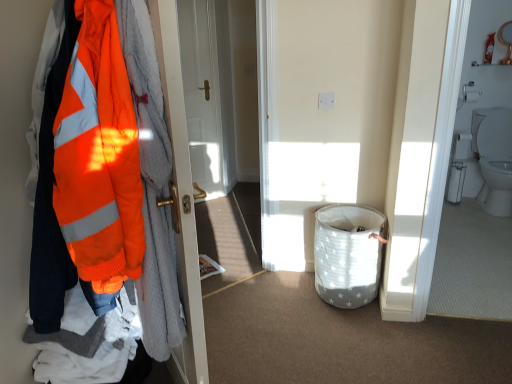
Question: Should I look upward or downward to see white glossy toilet at right?

Choices:
 (A) down
 (B) up

Answer: (B)

Question: From a real-world perspective, is white glossy door at center beneath white glossy toilet at right?

Choices:
 (A) yes
 (B) no

Answer: (B)

Question: Considering the relative positions of white glossy door at center and white glossy toilet at right in the image provided, is white glossy door at center to the right of white glossy toilet at right from the viewer's perspective?

Choices:
 (A) no
 (B) yes

Answer: (A)

Question: Are white glossy door at center and white glossy toilet at right making contact?

Choices:
 (A) yes
 (B) no

Answer: (B)

Question: Does white glossy door at center have a lesser height compared to white glossy toilet at right?

Choices:
 (A) yes
 (B) no

Answer: (B)

Question: Is white glossy door at center bigger than white glossy toilet at right?

Choices:
 (A) no
 (B) yes

Answer: (A)

Question: Is white glossy door at center not close to white glossy toilet at right?

Choices:
 (A) yes
 (B) no

Answer: (A)

Question: Can high-visibility orange jacket at left be found inside white glossy toilet at right?

Choices:
 (A) yes
 (B) no

Answer: (B)

Question: Is white glossy toilet at right far from high-visibility orange jacket at left?

Choices:
 (A) yes
 (B) no

Answer: (A)

Question: Is white glossy toilet at right oriented away from high-visibility orange jacket at left?

Choices:
 (A) yes
 (B) no

Answer: (B)

Question: From the image's perspective, is white glossy toilet at right above high-visibility orange jacket at left?

Choices:
 (A) no
 (B) yes

Answer: (B)

Question: Is white glossy toilet at right further to the viewer compared to high-visibility orange jacket at left?

Choices:
 (A) yes
 (B) no

Answer: (A)

Question: Considering the relative sizes of white glossy toilet at right and high-visibility orange jacket at left in the image provided, is white glossy toilet at right smaller than high-visibility orange jacket at left?

Choices:
 (A) yes
 (B) no

Answer: (A)

Question: Is white glossy toilet at right shorter than white glossy toilet at right?

Choices:
 (A) no
 (B) yes

Answer: (A)